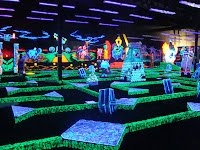
In order to click on game area in this screenshot , I will do `click(93, 85)`.